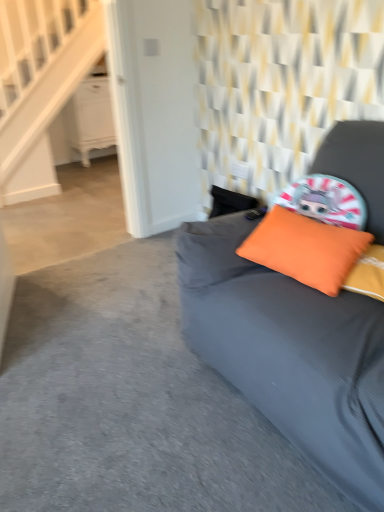
Question: Is orange fabric pillow at upper right spatially inside white wood stairwell at upper left, or outside of it?

Choices:
 (A) outside
 (B) inside

Answer: (A)

Question: Does point (319, 231) appear closer or farther from the camera than point (18, 132)?

Choices:
 (A) closer
 (B) farther

Answer: (A)

Question: Which of these objects is positioned farthest from the white wood stairwell at upper left?

Choices:
 (A) matte gray studio couch at center
 (B) orange fabric pillow at upper right
 (C) white glossy dresser at upper left

Answer: (B)

Question: Based on their relative distances, which object is farther from the white glossy dresser at upper left?

Choices:
 (A) white wood stairwell at upper left
 (B) matte gray studio couch at center
 (C) orange fabric pillow at upper right

Answer: (C)